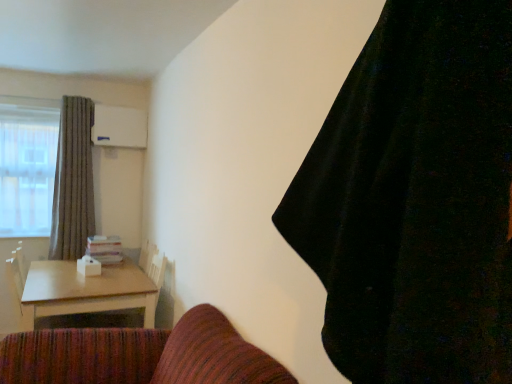
Describe the element at coordinates (90, 290) in the screenshot. I see `light brown wooden table at lower left` at that location.

Where is `gray textured curtain at left, the first curtain in the back-to-front sequence`? The width and height of the screenshot is (512, 384). gray textured curtain at left, the first curtain in the back-to-front sequence is located at coordinates (x=73, y=181).

Between light brown wooden table at lower left and gray textured curtain at left, which appears as the second curtain when viewed from the right, which one is positioned behind?

Positioned behind is gray textured curtain at left, which appears as the second curtain when viewed from the right.

Considering the relative sizes of light brown wooden table at lower left and gray textured curtain at left, which appears as the second curtain when viewed from the right, in the image provided, is light brown wooden table at lower left bigger than gray textured curtain at left, which appears as the second curtain when viewed from the right,?

Indeed, light brown wooden table at lower left has a larger size compared to gray textured curtain at left, which appears as the second curtain when viewed from the right.

Which object is positioned more to the left, light brown wooden table at lower left or gray textured curtain at left, marked as the first curtain in a left-to-right arrangement?

gray textured curtain at left, marked as the first curtain in a left-to-right arrangement, is more to the left.

Is point (101, 279) in front of point (81, 113)?

Yes, it is in front of point (81, 113).

Would you say light brown wooden table at lower left is outside black velvet curtain at upper right, the second curtain positioned from the left?

Yes.

Does light brown wooden table at lower left have a smaller size compared to black velvet curtain at upper right, the 1th curtain when ordered from right to left?

Incorrect, light brown wooden table at lower left is not smaller in size than black velvet curtain at upper right, the 1th curtain when ordered from right to left.

Consider the image. Is light brown wooden table at lower left turned away from black velvet curtain at upper right, which is the 1th curtain from front to back?

light brown wooden table at lower left is not turned away from black velvet curtain at upper right, which is the 1th curtain from front to back.

From the image's perspective, who appears lower, light brown wooden table at lower left or black velvet curtain at upper right, the second curtain positioned from the left?

From the image's view, light brown wooden table at lower left is below.

Is the position of gray textured curtain at left, marked as the second curtain in a front-to-back arrangement, less distant than that of black velvet curtain at upper right, the second curtain positioned from the left?

No, gray textured curtain at left, marked as the second curtain in a front-to-back arrangement, is further to the viewer.

Who is taller, gray textured curtain at left, marked as the second curtain in a front-to-back arrangement, or black velvet curtain at upper right, the second curtain positioned from the left?

Standing taller between the two is gray textured curtain at left, marked as the second curtain in a front-to-back arrangement.

Is gray textured curtain at left, marked as the first curtain in a left-to-right arrangement, spatially inside black velvet curtain at upper right, the second curtain positioned from the left, or outside of it?

gray textured curtain at left, marked as the first curtain in a left-to-right arrangement, is not enclosed by black velvet curtain at upper right, the second curtain positioned from the left.

Are gray textured curtain at left, which appears as the second curtain when viewed from the right, and black velvet curtain at upper right, marked as the 2th curtain in a back-to-front arrangement, located far from each other?

Yes.

Is black velvet curtain at upper right, which is the 1th curtain from front to back, not within light brown wooden table at lower left?

That's correct, black velvet curtain at upper right, which is the 1th curtain from front to back, is outside of light brown wooden table at lower left.

Can you confirm if black velvet curtain at upper right, which is the 1th curtain from front to back, is shorter than light brown wooden table at lower left?

No.

From the image's perspective, is black velvet curtain at upper right, the second curtain positioned from the left, over light brown wooden table at lower left?

Yes, from the image's perspective, black velvet curtain at upper right, the second curtain positioned from the left, is on top of light brown wooden table at lower left.

In the scene shown: Can you see black velvet curtain at upper right, the 1th curtain when ordered from right to left, touching light brown wooden table at lower left?

No, black velvet curtain at upper right, the 1th curtain when ordered from right to left, is not with light brown wooden table at lower left.

From the image's perspective, is gray textured curtain at left, which appears as the second curtain when viewed from the right, on top of light brown wooden table at lower left?

Yes, from the image's perspective, gray textured curtain at left, which appears as the second curtain when viewed from the right, is over light brown wooden table at lower left.

Is gray textured curtain at left, which appears as the second curtain when viewed from the right, shorter than light brown wooden table at lower left?

In fact, gray textured curtain at left, which appears as the second curtain when viewed from the right, may be taller than light brown wooden table at lower left.

Does gray textured curtain at left, marked as the first curtain in a left-to-right arrangement, have a larger size compared to light brown wooden table at lower left?

Actually, gray textured curtain at left, marked as the first curtain in a left-to-right arrangement, might be smaller than light brown wooden table at lower left.

Is point (85, 224) closer to camera compared to point (108, 310)?

No.

Considering their positions, is black velvet curtain at upper right, the 1th curtain when ordered from right to left, located in front of or behind gray textured curtain at left, marked as the first curtain in a left-to-right arrangement?

black velvet curtain at upper right, the 1th curtain when ordered from right to left, is positioned closer to the viewer than gray textured curtain at left, marked as the first curtain in a left-to-right arrangement.

From the picture: From a real-world perspective, between black velvet curtain at upper right, the 1th curtain when ordered from right to left, and gray textured curtain at left, the first curtain in the back-to-front sequence, who is vertically higher?

In real-world perspective, black velvet curtain at upper right, the 1th curtain when ordered from right to left, is above.

How far apart are black velvet curtain at upper right, the 1th curtain when ordered from right to left, and gray textured curtain at left, marked as the first curtain in a left-to-right arrangement?

black velvet curtain at upper right, the 1th curtain when ordered from right to left, is 11.39 feet from gray textured curtain at left, marked as the first curtain in a left-to-right arrangement.

The width and height of the screenshot is (512, 384). I want to click on curtain located on the left of light brown wooden table at lower left, so point(73,181).

Identify the location of curtain that is the 1st object located above the light brown wooden table at lower left (from the image's perspective). (415, 200).

Considering their positions, is gray textured curtain at left, which appears as the second curtain when viewed from the right, positioned closer to black velvet curtain at upper right, marked as the 2th curtain in a back-to-front arrangement, than light brown wooden table at lower left?

The object closer to black velvet curtain at upper right, marked as the 2th curtain in a back-to-front arrangement, is light brown wooden table at lower left.

Considering their positions, is light brown wooden table at lower left positioned further to gray textured curtain at left, marked as the first curtain in a left-to-right arrangement, than black velvet curtain at upper right, marked as the 2th curtain in a back-to-front arrangement?

Among the two, black velvet curtain at upper right, marked as the 2th curtain in a back-to-front arrangement, is located further to gray textured curtain at left, marked as the first curtain in a left-to-right arrangement.

Considering their positions, is black velvet curtain at upper right, the 1th curtain when ordered from right to left, positioned further to light brown wooden table at lower left than gray textured curtain at left, which appears as the second curtain when viewed from the right?

black velvet curtain at upper right, the 1th curtain when ordered from right to left, is positioned further to the anchor light brown wooden table at lower left.

In the scene shown: Which object lies nearer to the anchor point light brown wooden table at lower left, gray textured curtain at left, which appears as the second curtain when viewed from the right, or black velvet curtain at upper right, the second curtain positioned from the left?

gray textured curtain at left, which appears as the second curtain when viewed from the right.

Estimate the real-world distances between objects in this image. Which object is further from gray textured curtain at left, the first curtain in the back-to-front sequence, black velvet curtain at upper right, the 1th curtain when ordered from right to left, or light brown wooden table at lower left?

black velvet curtain at upper right, the 1th curtain when ordered from right to left, is further to gray textured curtain at left, the first curtain in the back-to-front sequence.

Which object lies nearer to the anchor point black velvet curtain at upper right, the 1th curtain when ordered from right to left, light brown wooden table at lower left or gray textured curtain at left, marked as the second curtain in a front-to-back arrangement?

light brown wooden table at lower left lies closer to black velvet curtain at upper right, the 1th curtain when ordered from right to left, than the other object.

Locate an element on the screen. This screenshot has width=512, height=384. table located between black velvet curtain at upper right, the 1th curtain when ordered from right to left, and gray textured curtain at left, the first curtain in the back-to-front sequence, in the depth direction is located at coordinates (90, 290).